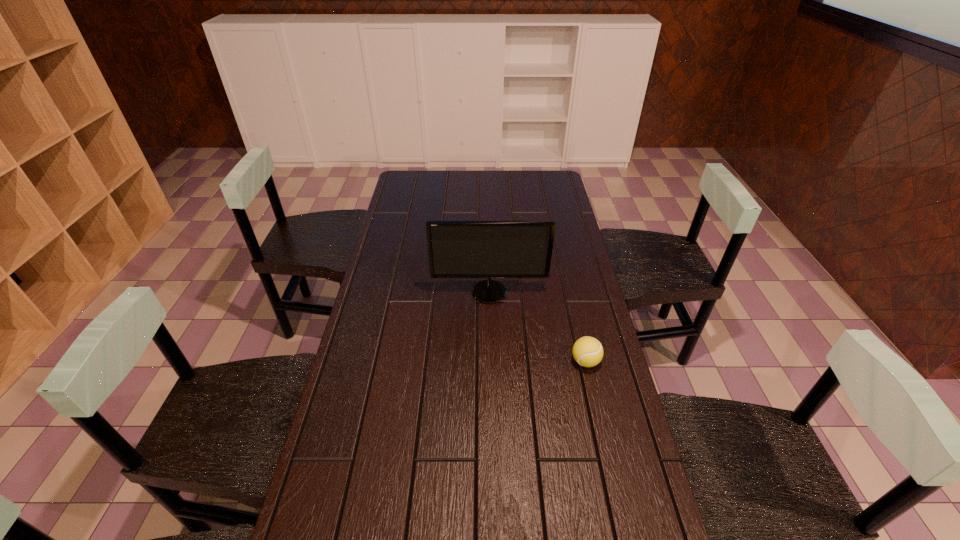
I want to click on computer monitor, so click(456, 249).

Where is `the left object`? the left object is located at coordinates (456, 249).

Find the location of a particular element. The width and height of the screenshot is (960, 540). the nearer object is located at coordinates (587, 351).

Find the location of a particular element. The height and width of the screenshot is (540, 960). the shorter object is located at coordinates (587, 351).

The width and height of the screenshot is (960, 540). What are the coordinates of `vacant space located on the front-facing side of the taller object` in the screenshot? It's located at (492, 399).

The image size is (960, 540). I want to click on vacant region located 0.050m on the back of the right object, so click(x=580, y=338).

At what (x,y) coordinates should I click in order to perform the action: click on computer monitor present at the right edge. Please return your answer as a coordinate pair (x, y). The image size is (960, 540). Looking at the image, I should click on (456, 249).

The width and height of the screenshot is (960, 540). Find the location of `tennis ball that is at the right edge`. tennis ball that is at the right edge is located at coordinates [x=587, y=351].

Locate an element on the screen. The height and width of the screenshot is (540, 960). vacant space at the far edge of the desktop is located at coordinates (470, 180).

Locate an element on the screen. This screenshot has height=540, width=960. free region at the left edge of the desktop is located at coordinates (377, 265).